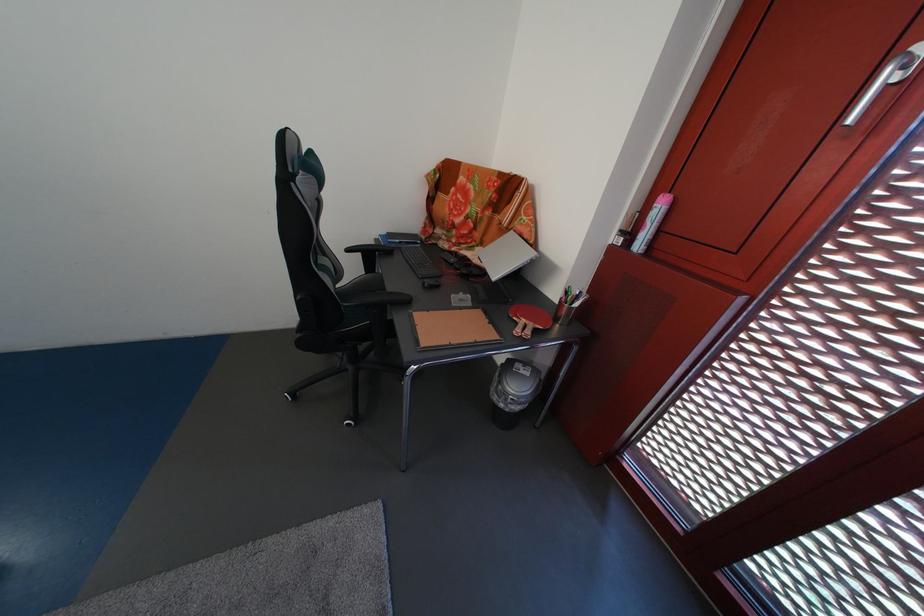
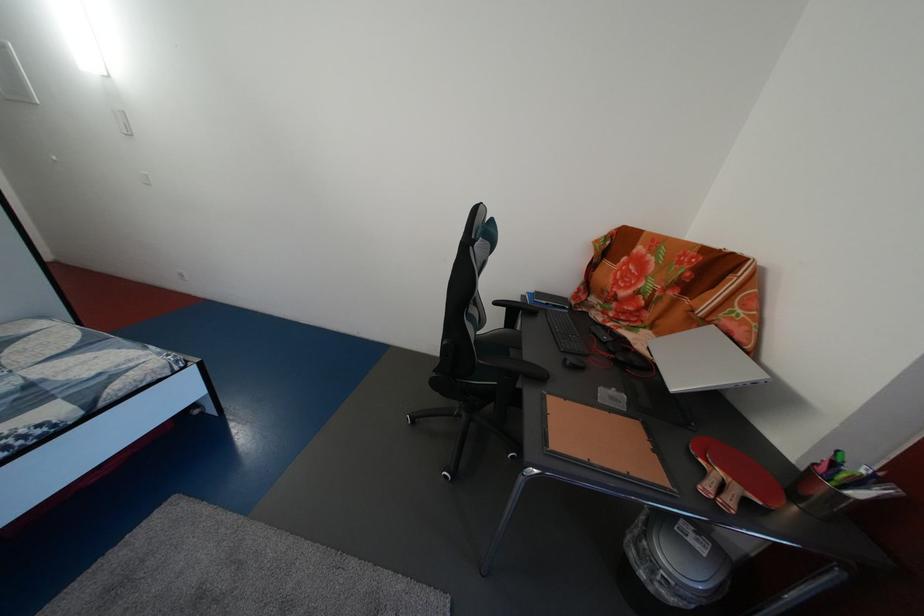
Question: The first image is from the beginning of the video and the second image is from the end. How did the camera likely rotate when shooting the video?

Choices:
 (A) Left
 (B) Right
 (C) Up
 (D) Down

Answer: (A)